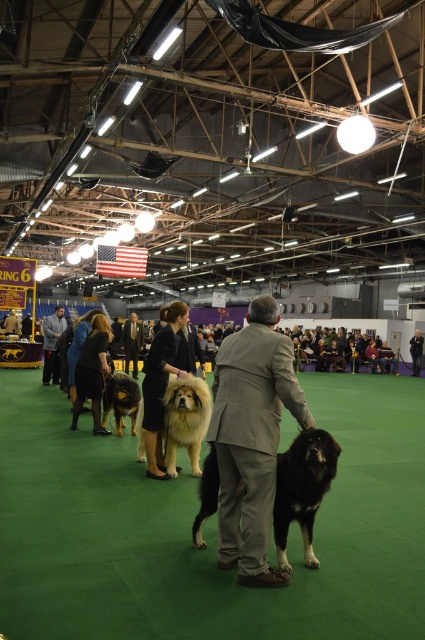
Which is more to the right, gray suit at center or black wool coat at center?

From the viewer's perspective, gray suit at center appears more on the right side.

This screenshot has height=640, width=425. What do you see at coordinates (252, 438) in the screenshot? I see `gray suit at center` at bounding box center [252, 438].

Measure the distance between point [255,467] and camera.

They are 9.44 feet apart.

Locate an element on the screen. gray suit at center is located at coordinates (252, 438).

Measure the distance between black fur dog at center and golden brown fur at center.

black fur dog at center and golden brown fur at center are 12.67 feet apart.

Which is above, black fur dog at center or golden brown fur at center?

black fur dog at center

Measure the distance between point (317, 490) and camera.

Point (317, 490) and camera are 9.77 feet apart.

Where is `black fur dog at center`? This screenshot has width=425, height=640. black fur dog at center is located at coordinates (303, 490).

Is gray suit at center closer to the viewer compared to black fur dog at center?

Yes.

Does gray suit at center appear under black fur dog at center?

Actually, gray suit at center is above black fur dog at center.

At what (x,y) coordinates should I click in order to perform the action: click on gray suit at center. Please return your answer as a coordinate pair (x, y). This screenshot has width=425, height=640. Looking at the image, I should click on (252, 438).

The width and height of the screenshot is (425, 640). I want to click on gray suit at center, so click(x=252, y=438).